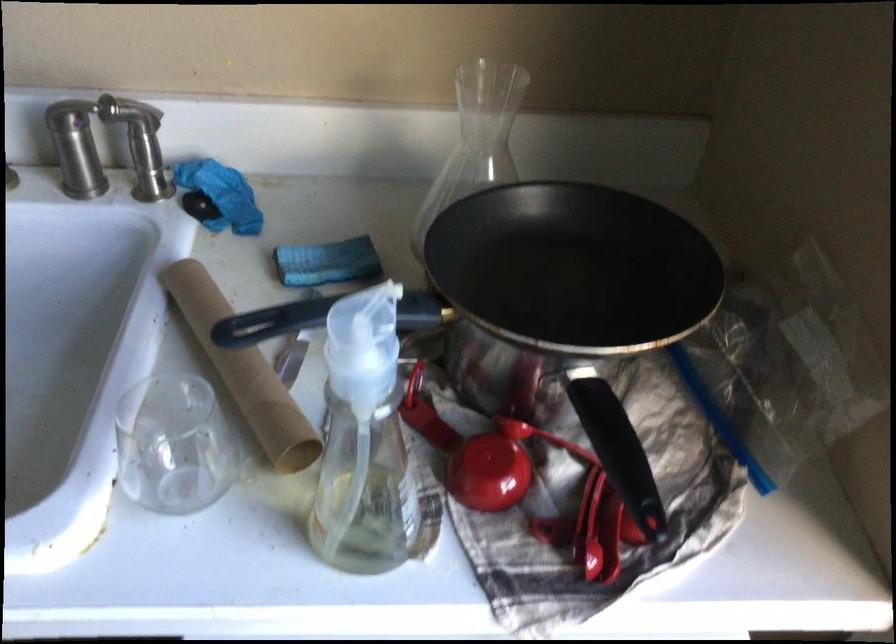
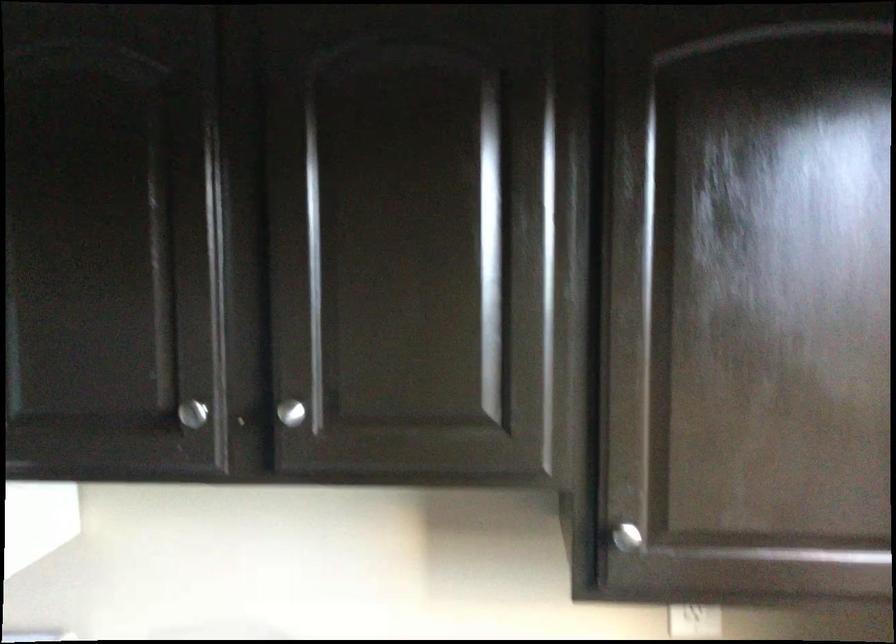
Question: Based on the continuous images, in which direction is the camera rotating? Reply with the corresponding letter.

Choices:
 (A) Left
 (B) Right
 (C) Up
 (D) Down

Answer: (C)